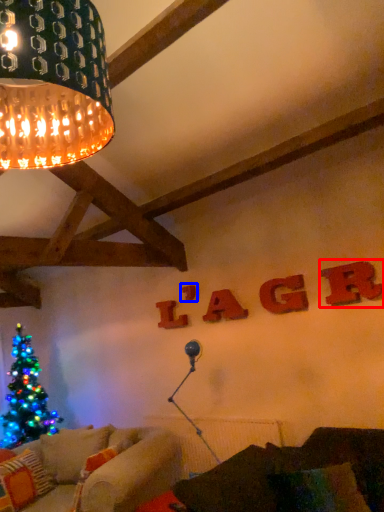
Question: Which of the following is the closest to the observer, letter (highlighted by a red box) or letter (highlighted by a blue box)?

Choices:
 (A) letter
 (B) letter

Answer: (A)